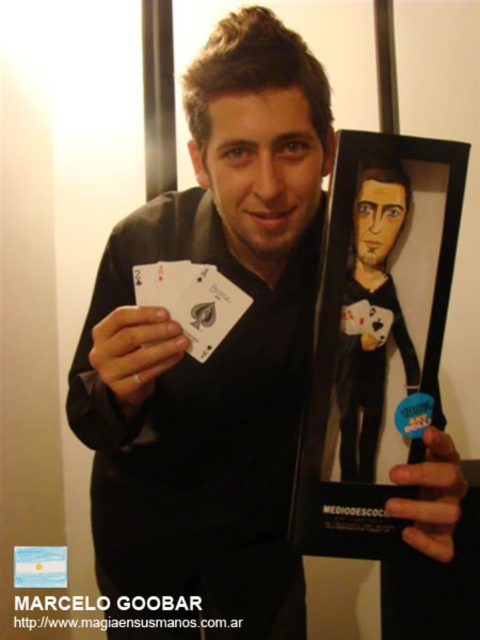
Does black paper playing cards at center appear on the right side of black paper at center?

Incorrect, black paper playing cards at center is not on the right side of black paper at center.

Based on the photo, does black paper playing cards at center appear on the left side of black paper at center?

Correct, you'll find black paper playing cards at center to the left of black paper at center.

Describe the element at coordinates (192, 300) in the screenshot. The width and height of the screenshot is (480, 640). I see `black paper playing cards at center` at that location.

Image resolution: width=480 pixels, height=640 pixels. I want to click on black paper playing cards at center, so (192, 300).

In the scene shown: Can you confirm if black plastic picture frame at right is taller than matte black figure at center?

Yes.

Can you confirm if black plastic picture frame at right is positioned to the right of matte black figure at center?

Correct, you'll find black plastic picture frame at right to the right of matte black figure at center.

Between point (308, 410) and point (362, 168), which one is positioned behind?

The point (308, 410) is behind.

This screenshot has width=480, height=640. Identify the location of black plastic picture frame at right. pyautogui.click(x=375, y=337).

Who is lower down, black plastic picture frame at right or black paper at center?

black plastic picture frame at right

Does black plastic picture frame at right appear on the right side of black paper at center?

Correct, you'll find black plastic picture frame at right to the right of black paper at center.

What do you see at coordinates (375, 337) in the screenshot? I see `black plastic picture frame at right` at bounding box center [375, 337].

The height and width of the screenshot is (640, 480). Identify the location of black plastic picture frame at right. (375, 337).